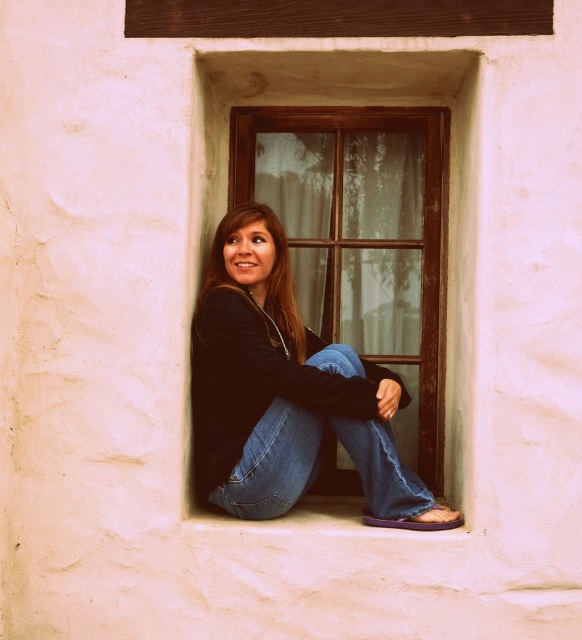
Question: Which of these objects is positioned closest to the smooth black hoodie at center?

Choices:
 (A) jeans at center
 (B) denim jeans at center

Answer: (A)

Question: Which object is the closest to the denim jeans at center?

Choices:
 (A) jeans at center
 (B) smooth black hoodie at center

Answer: (A)

Question: Where is jeans at center located in relation to denim jeans at center in the image?

Choices:
 (A) right
 (B) left

Answer: (B)

Question: Which point is farther to the camera?

Choices:
 (A) smooth black hoodie at center
 (B) jeans at center
 (C) denim jeans at center

Answer: (A)

Question: Is jeans at center positioned in front of smooth black hoodie at center?

Choices:
 (A) yes
 (B) no

Answer: (A)

Question: Is jeans at center to the left of smooth black hoodie at center from the viewer's perspective?

Choices:
 (A) yes
 (B) no

Answer: (B)